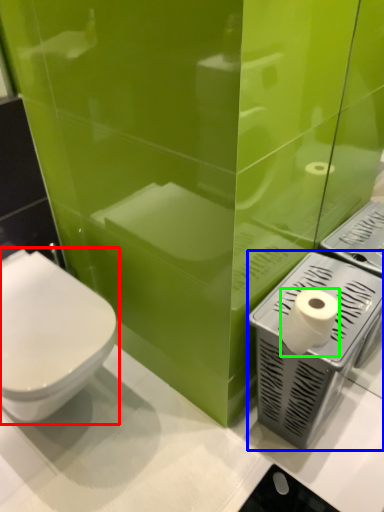
Question: Based on their relative distances, which object is farther from toilet (highlighted by a red box)? Choose from appliance (highlighted by a blue box) and toilet paper (highlighted by a green box).

Choices:
 (A) appliance
 (B) toilet paper

Answer: (B)